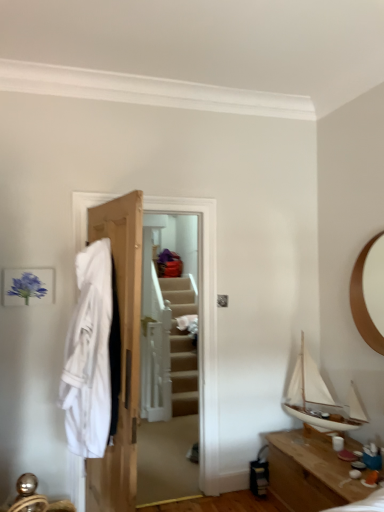
Question: Is white matte sailboat at right wider than wooden table at lower right?

Choices:
 (A) yes
 (B) no

Answer: (B)

Question: Can you confirm if white matte sailboat at right is thinner than wooden table at lower right?

Choices:
 (A) yes
 (B) no

Answer: (A)

Question: Is white matte sailboat at right at the left side of wooden table at lower right?

Choices:
 (A) no
 (B) yes

Answer: (A)

Question: Is white matte sailboat at right outside of wooden table at lower right?

Choices:
 (A) no
 (B) yes

Answer: (B)

Question: From the image's perspective, does white matte sailboat at right appear lower than wooden table at lower right?

Choices:
 (A) yes
 (B) no

Answer: (B)

Question: Are white matte sailboat at right and wooden table at lower right far apart?

Choices:
 (A) yes
 (B) no

Answer: (B)

Question: Is white cotton robe at left touching white matte sailboat at right?

Choices:
 (A) no
 (B) yes

Answer: (A)

Question: From the image's perspective, is white cotton robe at left under white matte sailboat at right?

Choices:
 (A) no
 (B) yes

Answer: (A)

Question: Could you tell me if white cotton robe at left is turned towards white matte sailboat at right?

Choices:
 (A) no
 (B) yes

Answer: (A)

Question: Is white cotton robe at left shorter than white matte sailboat at right?

Choices:
 (A) yes
 (B) no

Answer: (B)

Question: Is white cotton robe at left taller than white matte sailboat at right?

Choices:
 (A) yes
 (B) no

Answer: (A)

Question: Is white cotton robe at left far from white matte sailboat at right?

Choices:
 (A) no
 (B) yes

Answer: (B)

Question: Would you say white cotton robe at left contains wooden door at center?

Choices:
 (A) yes
 (B) no

Answer: (B)